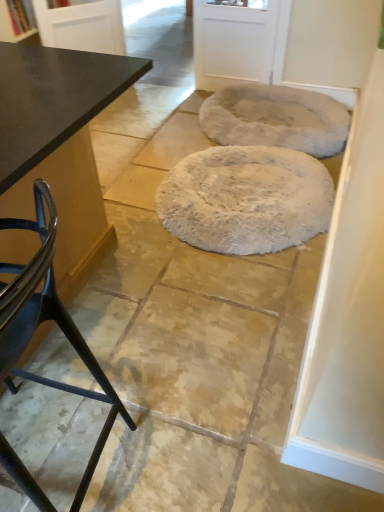
Where is `vacant area in front of white fluffy rug at center, the 1th mat when ordered from front to back`? This screenshot has width=384, height=512. vacant area in front of white fluffy rug at center, the 1th mat when ordered from front to back is located at coordinates (202, 314).